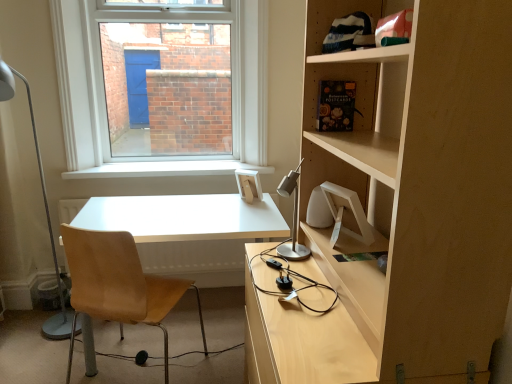
What do you see at coordinates (184, 217) in the screenshot? I see `white matte desk at center` at bounding box center [184, 217].

Find the location of `white metal table lamp at left, which is the first table lamp from back to front`. white metal table lamp at left, which is the first table lamp from back to front is located at coordinates (46, 216).

Measure the distance between point (104, 287) and camera.

Point (104, 287) and camera are 5.60 feet apart.

This screenshot has height=384, width=512. What are the coordinates of `white smooth window sill at center` in the screenshot? It's located at (165, 169).

From the image's perspective, which is above, white matte desk at center or white metal table lamp at left, which appears as the 2th table lamp when viewed from the front?

white metal table lamp at left, which appears as the 2th table lamp when viewed from the front, from the image's perspective.

Looking at this image, is the position of white matte desk at center less distant than that of white metal table lamp at left, which is the first table lamp from back to front?

No, it is not.

From a real-world perspective, does white matte desk at center sit lower than white metal table lamp at left, placed as the 2th table lamp when sorted from right to left?

Yes.

Is white matte desk at center not within white metal table lamp at left, which appears as the 2th table lamp when viewed from the front?

Indeed, white matte desk at center is completely outside white metal table lamp at left, which appears as the 2th table lamp when viewed from the front.

You are a GUI agent. You are given a task and a screenshot of the screen. Output one action in this format:
    pyautogui.click(x=<x>, y=<y>)
    Task: Click on the table lamp on the left side of white matte desk at center
    
    Given the screenshot: What is the action you would take?
    pyautogui.click(x=46, y=216)

Is white metal table lamp at left, marked as the first table lamp in a left-to-right arrangement, surrounding white matte desk at center?

Actually, white matte desk at center is outside white metal table lamp at left, marked as the first table lamp in a left-to-right arrangement.

Which is closer, (x=0, y=83) or (x=138, y=232)?

The point (x=138, y=232) is more forward.

Is white metal table lamp at left, marked as the first table lamp in a left-to-right arrangement, beside white matte desk at center?

No.

Considering the sizes of objects white metal table lamp at left, which is the first table lamp from back to front, and white smooth window sill at center in the image provided, who is shorter, white metal table lamp at left, which is the first table lamp from back to front, or white smooth window sill at center?

white smooth window sill at center is shorter.

Which is behind, white metal table lamp at left, which appears as the 2th table lamp when viewed from the front, or white smooth window sill at center?

white smooth window sill at center.

Can you confirm if white metal table lamp at left, which is the first table lamp from back to front, is positioned to the right of white smooth window sill at center?

No.

Is white metal table lamp at left, marked as the first table lamp in a left-to-right arrangement, not near white smooth window sill at center?

Actually, white metal table lamp at left, marked as the first table lamp in a left-to-right arrangement, and white smooth window sill at center are a little close together.

From the image's perspective, does white smooth window sill at center appear higher than white matte desk at center?

Yes.

Considering the sizes of objects white smooth window sill at center and white matte desk at center in the image provided, who is smaller, white smooth window sill at center or white matte desk at center?

white smooth window sill at center is smaller.

Considering the positions of point (119, 163) and point (97, 197), is point (119, 163) closer or farther from the camera than point (97, 197)?

Point (119, 163) is farther from the camera than point (97, 197).

At what (x,y) coordinates should I click in order to perform the action: click on window sill on the left of white matte desk at center. Please return your answer as a coordinate pair (x, y). Image resolution: width=512 pixels, height=384 pixels. Looking at the image, I should click on (165, 169).

Who is smaller, white matte desk at center or satin silver table lamp at center, which is counted as the 1th table lamp, starting from the front?

With smaller size is satin silver table lamp at center, which is counted as the 1th table lamp, starting from the front.

Could you tell me if white matte desk at center is turned towards satin silver table lamp at center, which is counted as the second table lamp, starting from the back?

No, white matte desk at center is not facing towards satin silver table lamp at center, which is counted as the second table lamp, starting from the back.

Is white matte desk at center wider than satin silver table lamp at center, which is counted as the 2th table lamp, starting from the left?

Yes.

Is satin silver table lamp at center, which is counted as the 1th table lamp, starting from the front, a part of white smooth window sill at center?

No, satin silver table lamp at center, which is counted as the 1th table lamp, starting from the front, is not inside white smooth window sill at center.

Is white smooth window sill at center at the left side of satin silver table lamp at center, which is counted as the 2th table lamp, starting from the left?

Correct, you'll find white smooth window sill at center to the left of satin silver table lamp at center, which is counted as the 2th table lamp, starting from the left.

Who is smaller, white smooth window sill at center or satin silver table lamp at center, which is counted as the second table lamp, starting from the back?

satin silver table lamp at center, which is counted as the second table lamp, starting from the back, is smaller.

Is white matte desk at center far away from light brown leather chair at left?

No, white matte desk at center is not far from light brown leather chair at left.

Is white matte desk at center spatially inside light brown leather chair at left, or outside of it?

white matte desk at center exists outside the volume of light brown leather chair at left.

Is white matte desk at center facing away from light brown leather chair at left?

Correct, white matte desk at center is looking away from light brown leather chair at left.

Which table lamp is the 1st one when counting from the front of the white matte desk at center? Please provide its 2D coordinates.

[(46, 216)]

This screenshot has height=384, width=512. Identify the location of table on the right of white metal table lamp at left, which is the first table lamp from back to front. (184, 217).

Considering their positions, is white metal table lamp at left, which is the first table lamp from back to front, positioned closer to white smooth window sill at center than light brown leather chair at left?

Based on the image, white metal table lamp at left, which is the first table lamp from back to front, appears to be nearer to white smooth window sill at center.

When comparing their distances from white metal table lamp at left, which appears as the 2th table lamp when viewed from the front, does white matte desk at center or white smooth window sill at center seem further?

white matte desk at center.

Considering their positions, is satin silver table lamp at center, which is counted as the 1th table lamp, starting from the front, positioned closer to white smooth window sill at center than light brown leather chair at left?

light brown leather chair at left is closer to white smooth window sill at center.

Based on the photo, considering their positions, is light brown leather chair at left positioned closer to white matte desk at center than white smooth window sill at center?

Among the two, light brown leather chair at left is located nearer to white matte desk at center.

Considering their positions, is satin silver table lamp at center, which is counted as the 2th table lamp, starting from the left, positioned closer to white metal table lamp at left, placed as the 2th table lamp when sorted from right to left, than white smooth window sill at center?

white smooth window sill at center is closer to white metal table lamp at left, placed as the 2th table lamp when sorted from right to left.

When comparing their distances from white smooth window sill at center, does white matte desk at center or white metal table lamp at left, marked as the first table lamp in a left-to-right arrangement, seem further?

white metal table lamp at left, marked as the first table lamp in a left-to-right arrangement, lies further to white smooth window sill at center than the other object.

Looking at the image, which one is located further to satin silver table lamp at center, which ranks as the 1th table lamp in right-to-left order, white metal table lamp at left, marked as the first table lamp in a left-to-right arrangement, or white matte desk at center?

Among the two, white metal table lamp at left, marked as the first table lamp in a left-to-right arrangement, is located further to satin silver table lamp at center, which ranks as the 1th table lamp in right-to-left order.

Looking at the image, which one is located closer to white matte desk at center, white metal table lamp at left, which is the first table lamp from back to front, or light brown leather chair at left?

light brown leather chair at left.

Where is `window sill between white metal table lamp at left, which is the first table lamp from back to front, and satin silver table lamp at center, which is counted as the 2th table lamp, starting from the left, from left to right`? The width and height of the screenshot is (512, 384). window sill between white metal table lamp at left, which is the first table lamp from back to front, and satin silver table lamp at center, which is counted as the 2th table lamp, starting from the left, from left to right is located at coordinates (165, 169).

Find the location of a particular element. This screenshot has height=384, width=512. table located between light brown leather chair at left and satin silver table lamp at center, which is counted as the 1th table lamp, starting from the front, in the left-right direction is located at coordinates (184, 217).

The width and height of the screenshot is (512, 384). Identify the location of table between white metal table lamp at left, which appears as the 2th table lamp when viewed from the front, and white smooth window sill at center in the front-back direction. (184, 217).

This screenshot has width=512, height=384. What are the coordinates of `table lamp between light brown leather chair at left and white smooth window sill at center from front to back` in the screenshot? It's located at (46, 216).